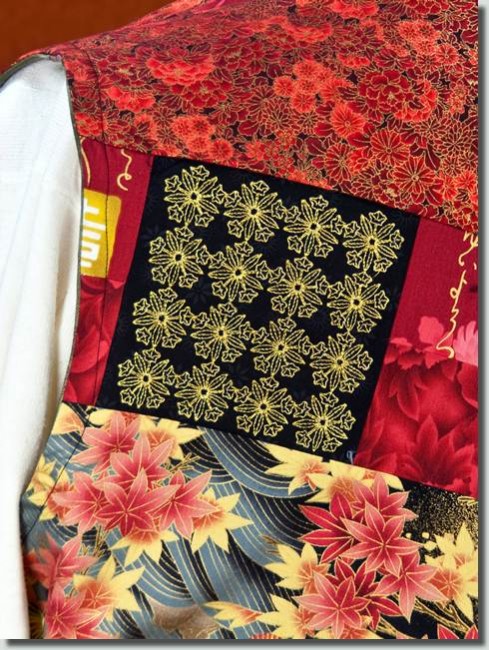
Identify the location of middle portion of pillowcase. (332, 337).